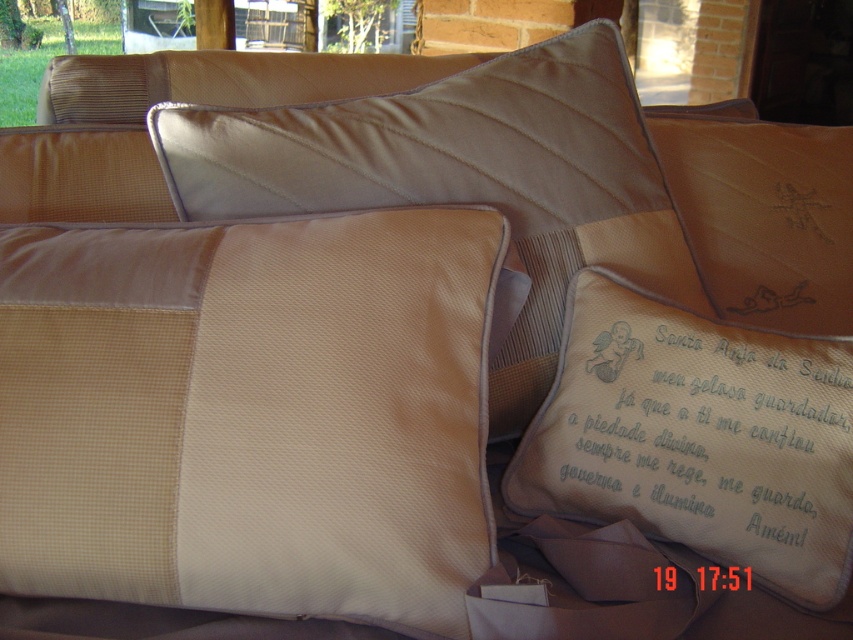
Question: Which object appears closest to the camera in this image?

Choices:
 (A) satin beige pillow at center
 (B) beige fabric pillow at center
 (C) satin embroidered pillow at center

Answer: (B)

Question: Does beige fabric pillow at center appear on the right side of white embroidered pillow at lower right?

Choices:
 (A) yes
 (B) no

Answer: (B)

Question: Can you confirm if satin beige pillow at center is bigger than white embroidered pillow at lower right?

Choices:
 (A) yes
 (B) no

Answer: (A)

Question: Among these points, which one is nearest to the camera?

Choices:
 (A) (741, 294)
 (B) (773, 348)
 (C) (256, 416)

Answer: (C)

Question: Does beige fabric pillow at center have a lesser width compared to satin beige pillow at center?

Choices:
 (A) no
 (B) yes

Answer: (B)

Question: Among these objects, which one is farthest from the camera?

Choices:
 (A) beige fabric pillow at center
 (B) satin beige pillow at center
 (C) satin embroidered pillow at center
 (D) white embroidered pillow at lower right

Answer: (C)